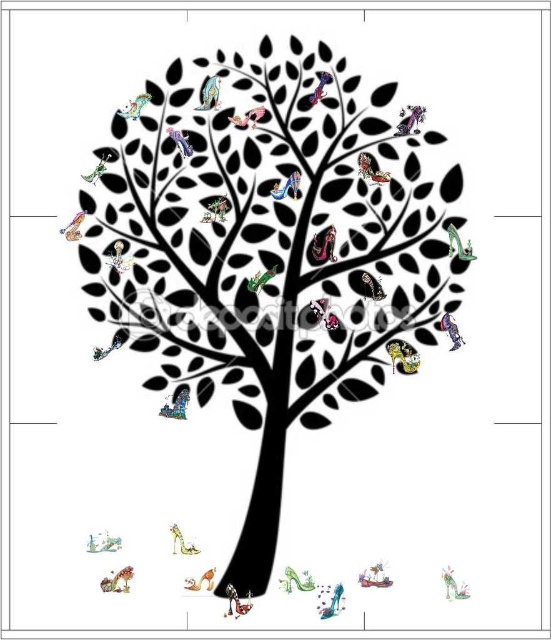
Question: Which object appears closest to the camera in this image?

Choices:
 (A) metallic purple bird at upper right
 (B) multicolored feathers at lower left

Answer: (B)

Question: Considering the real-world distances, which object is closest to the shiny metallic shoe at lower right?

Choices:
 (A) metallic purple bird at upper right
 (B) black matte tree at center
 (C) metallic blue bird at upper center

Answer: (B)

Question: Does multicolored feathers at lower left have a greater width compared to metallic silver bird at upper left?

Choices:
 (A) yes
 (B) no

Answer: (B)

Question: Which of the following is the closest to the observer?

Choices:
 (A) black matte tree at center
 (B) green glossy high-heeled shoe at lower center
 (C) metallic pink bird at upper center

Answer: (A)

Question: Can you confirm if metallic pink bird at upper center is thinner than metallic blue bird at upper center?

Choices:
 (A) no
 (B) yes

Answer: (A)

Question: Can you confirm if metallic purple bird at upper right is wider than multicolored feathers at lower left?

Choices:
 (A) no
 (B) yes

Answer: (B)